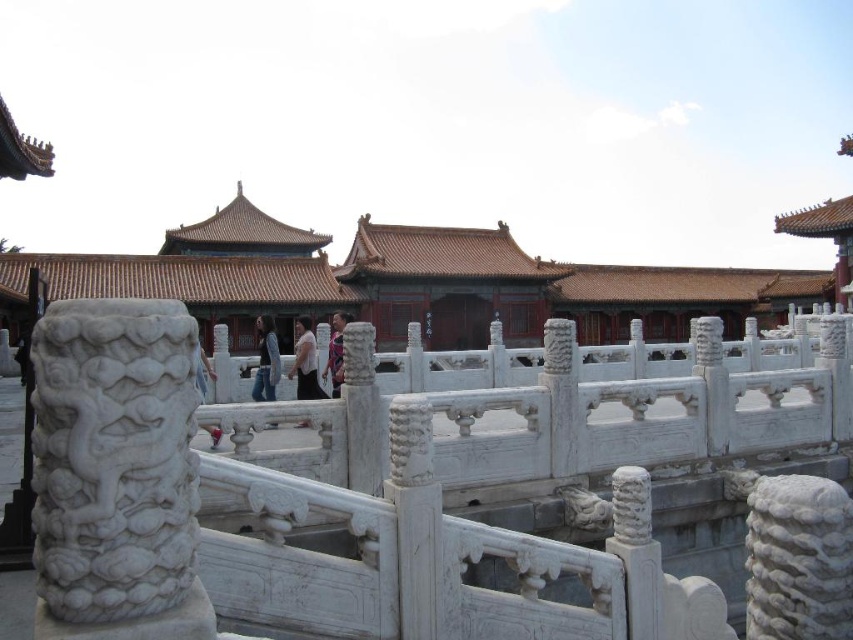
Question: Which object is positioned farthest from the light brown fabric shirt at center?

Choices:
 (A) matte pink dress at center
 (B) white stone palace at center
 (C) dark blue jeans at center

Answer: (B)

Question: Can you confirm if dark blue jeans at center is positioned below matte pink dress at center?

Choices:
 (A) yes
 (B) no

Answer: (A)

Question: Is white stone palace at center smaller than matte pink dress at center?

Choices:
 (A) yes
 (B) no

Answer: (B)

Question: Does light brown fabric shirt at center have a greater width compared to matte pink dress at center?

Choices:
 (A) yes
 (B) no

Answer: (A)

Question: Which of the following is the farthest from the observer?

Choices:
 (A) (340, 333)
 (B) (370, 253)
 (C) (315, 387)
 (D) (260, 380)

Answer: (B)

Question: Estimate the real-world distances between objects in this image. Which object is closer to the matte pink dress at center?

Choices:
 (A) white stone palace at center
 (B) dark blue jeans at center
 (C) light brown fabric shirt at center

Answer: (C)